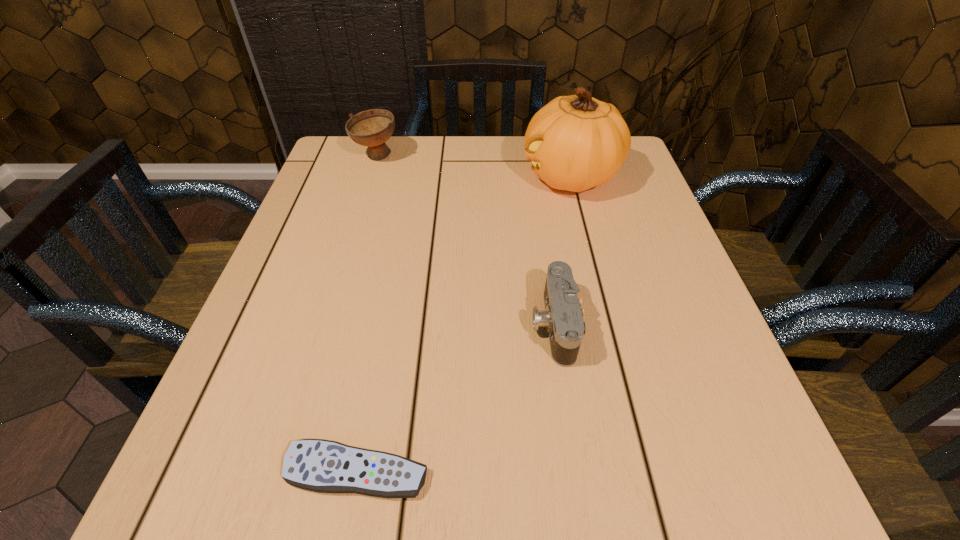
Where is `pumpkin`? The height and width of the screenshot is (540, 960). pumpkin is located at coordinates (576, 142).

Where is `the third shortest object`? the third shortest object is located at coordinates (372, 128).

Where is `the second shortest object`? This screenshot has width=960, height=540. the second shortest object is located at coordinates (562, 317).

Image resolution: width=960 pixels, height=540 pixels. I want to click on camera, so click(562, 317).

Identify the location of the shortest object. (318, 465).

The image size is (960, 540). In order to click on the nearest object in this screenshot , I will do `click(318, 465)`.

In order to click on vacant area situated on the front face of the tallest object in this screenshot , I will do `click(441, 177)`.

Where is `vacant space located on the front face of the tallest object`? The width and height of the screenshot is (960, 540). vacant space located on the front face of the tallest object is located at coordinates (481, 177).

What are the coordinates of `free space located on the front face of the tallest object` in the screenshot? It's located at (417, 177).

You are a GUI agent. You are given a task and a screenshot of the screen. Output one action in this format:
    pyautogui.click(x=<x>, y=<y>)
    Task: Click on the free spot located 0.330m on the right of the third shortest object
    
    Given the screenshot: What is the action you would take?
    pyautogui.click(x=525, y=157)